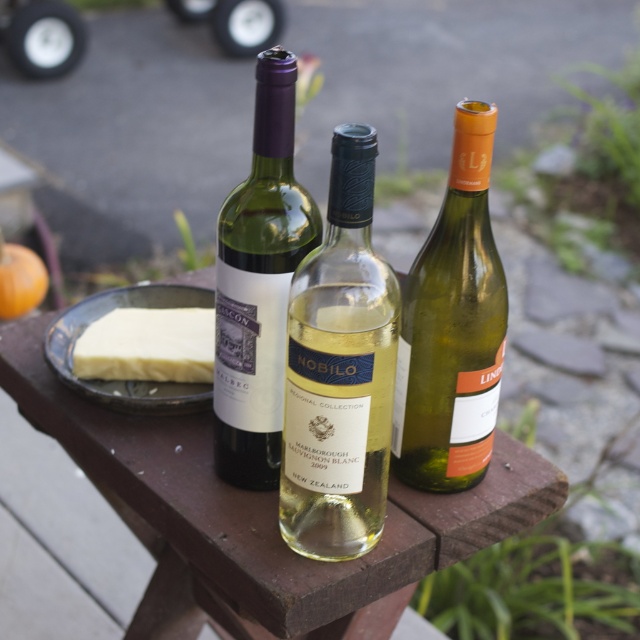
Can you confirm if wooden table at center is smaller than white creamy cheese at left?

No.

Which is behind, point (93, 426) or point (90, 326)?

The point (90, 326) is more distant.

Where is `wooden table at center`? wooden table at center is located at coordinates (259, 516).

Can you confirm if matte glass wine bottle at center is bigger than white matte cheese at center?

Yes, matte glass wine bottle at center is bigger than white matte cheese at center.

Is point (272, 262) closer to viewer compared to point (204, 294)?

Yes.

Locate an element on the screen. This screenshot has height=640, width=640. matte glass wine bottle at center is located at coordinates (259, 284).

Does wooden table at center lie behind white matte cheese at center?

That is False.

Which is in front, point (461, 512) or point (157, 412)?

Positioned in front is point (461, 512).

Image resolution: width=640 pixels, height=640 pixels. In order to click on wooden table at center in this screenshot , I will do `click(259, 516)`.